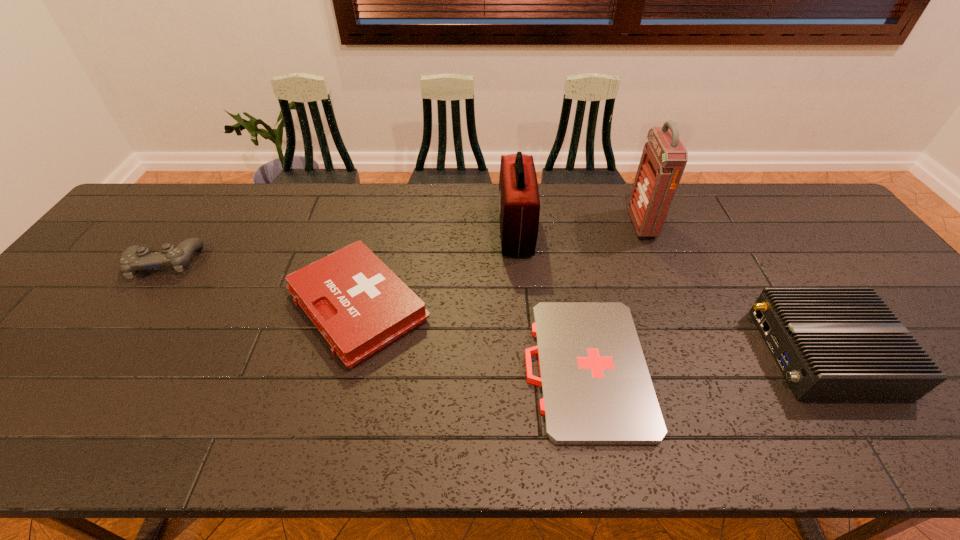
Locate an element on the screen. The width and height of the screenshot is (960, 540). free area in between the second tallest object and the third tallest first-aid kit is located at coordinates (437, 269).

What are the coordinates of `free spot between the tallest first-aid kit and the shortest first-aid kit` in the screenshot? It's located at (613, 296).

Find the location of a particular element. The width and height of the screenshot is (960, 540). vacant space that's between the second object from right to left and the fourth shortest object is located at coordinates (732, 288).

This screenshot has width=960, height=540. Find the location of `free area in between the third tallest object and the control`. free area in between the third tallest object and the control is located at coordinates (493, 308).

At what (x,y) coordinates should I click in order to perform the action: click on empty space between the tallest object and the second tallest first-aid kit. Please return your answer as a coordinate pair (x, y). The image size is (960, 540). Looking at the image, I should click on (579, 227).

Find the location of `free spot between the leftmost first-aid kit and the control`. free spot between the leftmost first-aid kit and the control is located at coordinates (261, 285).

Where is `vacant region between the shortest object and the leftmost first-aid kit`? The image size is (960, 540). vacant region between the shortest object and the leftmost first-aid kit is located at coordinates (471, 338).

The image size is (960, 540). I want to click on vacant space in between the third tallest object and the fifth shortest object, so click(x=670, y=292).

You are a GUI agent. You are given a task and a screenshot of the screen. Output one action in this format:
    pyautogui.click(x=<x>, y=<y>)
    Task: Click on the free space between the tallest object and the shortest first-aid kit
    This screenshot has height=540, width=960.
    Given the screenshot: What is the action you would take?
    pyautogui.click(x=613, y=296)

Where is `vacant space in between the tallest first-aid kit and the control`? The width and height of the screenshot is (960, 540). vacant space in between the tallest first-aid kit and the control is located at coordinates (403, 244).